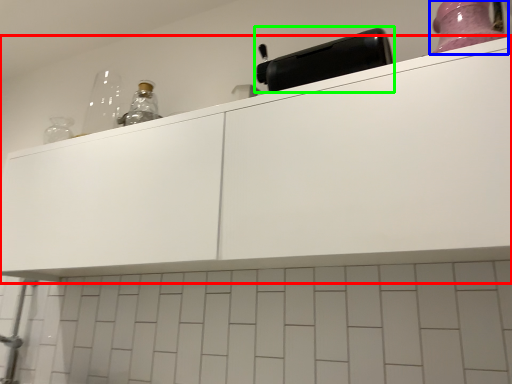
Question: Estimate the real-world distances between objects in this image. Which object is closer to cabinetry (highlighted by a red box), bottle (highlighted by a blue box) or appliance (highlighted by a green box)?

Choices:
 (A) bottle
 (B) appliance

Answer: (B)